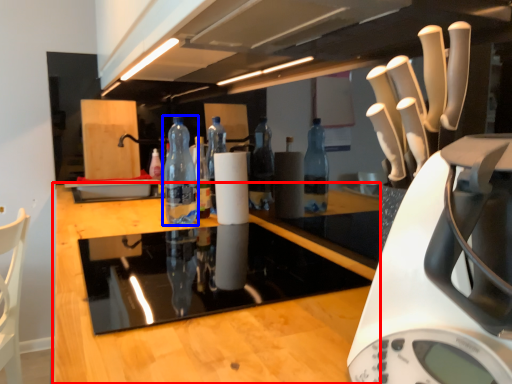
Question: Which object is closer to the camera taking this photo, countertop (highlighted by a red box) or bottle (highlighted by a blue box)?

Choices:
 (A) countertop
 (B) bottle

Answer: (A)